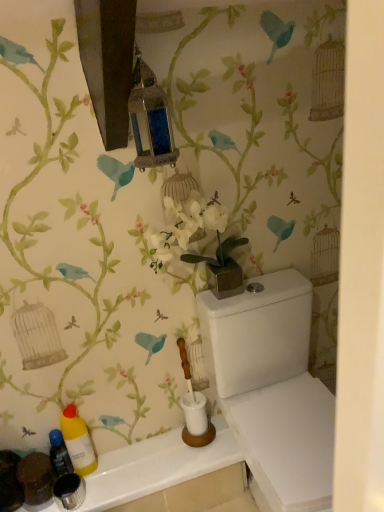
The image size is (384, 512). In order to click on vacant area located to the right-hand side of yellow matte bottle at lower left, which is counted as the second bottle, starting from the left in this screenshot , I will do `click(134, 462)`.